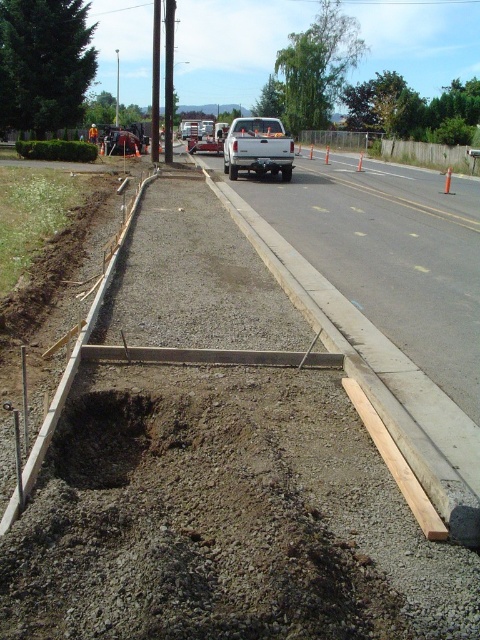
You are a construction worker standing at the brown dirt hole at center. You need to retrieve an orange safety vest at center. Considering the distance between them, can you walk directly to the vest without needing to go around any obstacles?

The distance between the brown dirt hole at center and the orange safety vest at center is 40.45 meters. Since there are no obstacles mentioned in the scene, you can walk directly to the vest.